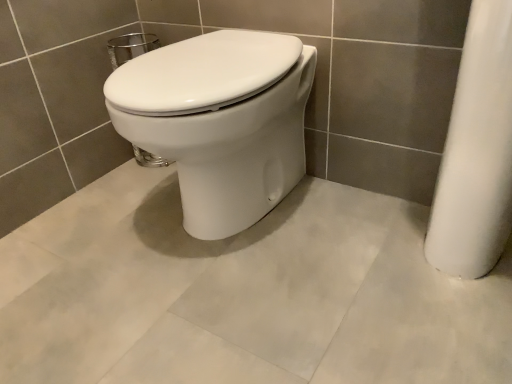
The image size is (512, 384). I want to click on white glossy toilet at center, so click(x=220, y=121).

The height and width of the screenshot is (384, 512). Describe the element at coordinates (220, 121) in the screenshot. I see `white glossy toilet at center` at that location.

Measure the distance between white glossy toilet at center and camera.

white glossy toilet at center is 29.40 inches away from camera.

Locate an element on the screen. The height and width of the screenshot is (384, 512). white glossy toilet at center is located at coordinates (220, 121).